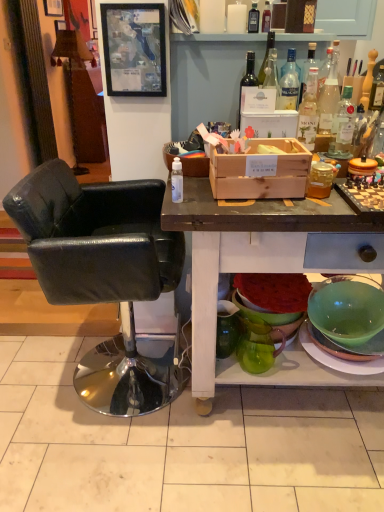
The image size is (384, 512). What do you see at coordinates (177, 181) in the screenshot? I see `transparent plastic spray bottle at center, positioned as the first bottle in front-to-back order` at bounding box center [177, 181].

Where is `matte black picture frame at upper center, the first picture frame positioned from the front`? Image resolution: width=384 pixels, height=512 pixels. matte black picture frame at upper center, the first picture frame positioned from the front is located at coordinates [x=134, y=49].

What do you see at coordinates (227, 328) in the screenshot?
I see `green glass pitcher at lower center, the second pitcher viewed from the right` at bounding box center [227, 328].

Describe the element at coordinates (265, 268) in the screenshot. I see `wooden crate at center` at that location.

What do you see at coordinates (344, 121) in the screenshot?
I see `clear glass bottle at upper right, acting as the seventh bottle starting from the back` at bounding box center [344, 121].

You are a GUI agent. You are given a task and a screenshot of the screen. Output one action in this format:
    pyautogui.click(x=<x>, y=<y>)
    Task: Click on the wooden knife block at upper right, which is counted as the 1th bottle, starting from the right
    This screenshot has height=512, width=384.
    Given the screenshot: What is the action you would take?
    pyautogui.click(x=368, y=79)

From a real-world perspective, which object rests below the other?

From a 3D spatial view, wooden crate at center is below.

Does wooden crate at center turn towards matte black picture frame at upper center, positioned as the 1th picture frame in right-to-left order?

No, wooden crate at center is not aimed at matte black picture frame at upper center, positioned as the 1th picture frame in right-to-left order.

Who is taller, wooden crate at center or matte black picture frame at upper center, positioned as the 1th picture frame in right-to-left order?

With more height is matte black picture frame at upper center, positioned as the 1th picture frame in right-to-left order.

From the picture: Between wooden crate at center and matte black picture frame at upper center, which appears as the 2th picture frame when viewed from the left, which one is positioned behind?

matte black picture frame at upper center, which appears as the 2th picture frame when viewed from the left, is further from the camera.

From a real-world perspective, which is physically below, wooden picture frame at upper left, the second picture frame from the front, or green glass pitcher at lower center, the first pitcher in the right-to-left sequence?

In real-world perspective, green glass pitcher at lower center, the first pitcher in the right-to-left sequence, is lower.

Which is behind, point (46, 1) or point (264, 353)?

The point (46, 1) is more distant.

From the image's perspective, which one is positioned lower, wooden picture frame at upper left, arranged as the 1th picture frame when viewed from the left, or green glass pitcher at lower center, the first pitcher in the right-to-left sequence?

green glass pitcher at lower center, the first pitcher in the right-to-left sequence, appears lower in the image.

Is the depth of wooden picture frame at upper left, arranged as the 1th picture frame when viewed from the left, less than that of green glass pitcher at lower center, the first pitcher in the right-to-left sequence?

No.

In the scene shown: Considering the positions of objects translucent glass bottle at upper center, arranged as the sixth bottle when viewed from the right, and matte glass wine bottle at upper center, positioned as the sixth bottle in back-to-front order, in the image provided, who is behind, translucent glass bottle at upper center, arranged as the sixth bottle when viewed from the right, or matte glass wine bottle at upper center, positioned as the sixth bottle in back-to-front order,?

translucent glass bottle at upper center, arranged as the sixth bottle when viewed from the right, is further from the camera.

Are translucent glass bottle at upper center, the 3th bottle positioned from the back, and matte glass wine bottle at upper center, which is counted as the fourth bottle, starting from the front, far apart?

translucent glass bottle at upper center, the 3th bottle positioned from the back, is near matte glass wine bottle at upper center, which is counted as the fourth bottle, starting from the front, not far away.

Considering the relative sizes of translucent glass bottle at upper center, arranged as the sixth bottle when viewed from the right, and matte glass wine bottle at upper center, the eighth bottle in the right-to-left sequence, in the image provided, is translucent glass bottle at upper center, arranged as the sixth bottle when viewed from the right, smaller than matte glass wine bottle at upper center, the eighth bottle in the right-to-left sequence,?

Yes, translucent glass bottle at upper center, arranged as the sixth bottle when viewed from the right, is smaller than matte glass wine bottle at upper center, the eighth bottle in the right-to-left sequence.

In the scene shown: From the image's perspective, is translucent glass bottle at upper center, which is the 7th bottle from front to back, located above or below matte glass wine bottle at upper center, which is counted as the 2th bottle, starting from the left?

Based on their image positions, translucent glass bottle at upper center, which is the 7th bottle from front to back, is located above matte glass wine bottle at upper center, which is counted as the 2th bottle, starting from the left.

From a real-world perspective, does translucent glass bottle at upper center, arranged as the sixth bottle when viewed from the right, sit lower than wooden picture frame at upper left, the first picture frame in the top-to-bottom sequence?

Yes.

Considering the sizes of translucent glass bottle at upper center, the 3th bottle positioned from the back, and wooden picture frame at upper left, which is the second picture frame in bottom-to-top order, in the image, is translucent glass bottle at upper center, the 3th bottle positioned from the back, taller or shorter than wooden picture frame at upper left, which is the second picture frame in bottom-to-top order,?

Considering their sizes, translucent glass bottle at upper center, the 3th bottle positioned from the back, has less height than wooden picture frame at upper left, which is the second picture frame in bottom-to-top order.

Based on the photo, is translucent glass bottle at upper center, which is the 7th bottle from front to back, not within wooden picture frame at upper left, arranged as the 1th picture frame when viewed from the left?

translucent glass bottle at upper center, which is the 7th bottle from front to back, lies outside wooden picture frame at upper left, arranged as the 1th picture frame when viewed from the left,'s area.

Is translucent glass bottle at upper center, the 3th bottle positioned from the back, to the left or to the right of wooden picture frame at upper left, the second picture frame from the front, in the image?

In the image, translucent glass bottle at upper center, the 3th bottle positioned from the back, appears on the right side of wooden picture frame at upper left, the second picture frame from the front.

Considering the relative sizes of green glass pitcher at lower center, the first pitcher in the right-to-left sequence, and translucent glass bottle at upper center, arranged as the sixth bottle when viewed from the right, in the image provided, is green glass pitcher at lower center, the first pitcher in the right-to-left sequence, bigger than translucent glass bottle at upper center, arranged as the sixth bottle when viewed from the right,?

Yes, green glass pitcher at lower center, the first pitcher in the right-to-left sequence, is bigger than translucent glass bottle at upper center, arranged as the sixth bottle when viewed from the right.

Can you tell me how much green glass pitcher at lower center, the 2th pitcher positioned from the left, and translucent glass bottle at upper center, which is the 7th bottle from front to back, differ in facing direction?

85 degrees separate the facing orientations of green glass pitcher at lower center, the 2th pitcher positioned from the left, and translucent glass bottle at upper center, which is the 7th bottle from front to back.

From their relative heights in the image, would you say green glass pitcher at lower center, the first pitcher in the right-to-left sequence, is taller or shorter than translucent glass bottle at upper center, which ranks as the 4th bottle in left-to-right order?

Clearly, green glass pitcher at lower center, the first pitcher in the right-to-left sequence, is taller compared to translucent glass bottle at upper center, which ranks as the 4th bottle in left-to-right order.

Is green glass pitcher at lower center, the first pitcher in the right-to-left sequence, inside or outside of translucent glass bottle at upper center, the 3th bottle positioned from the back?

green glass pitcher at lower center, the first pitcher in the right-to-left sequence, is not inside translucent glass bottle at upper center, the 3th bottle positioned from the back, it's outside.

Are matte glass wine bottle at upper center, positioned as the sixth bottle in back-to-front order, and wooden crate at center far apart?

No, there isn't a large distance between matte glass wine bottle at upper center, positioned as the sixth bottle in back-to-front order, and wooden crate at center.

Which point is more forward, (249, 78) or (295, 173)?

The point (295, 173) is more forward.

Is matte glass wine bottle at upper center, the eighth bottle in the right-to-left sequence, positioned with its back to wooden crate at center?

No.

You are a GUI agent. You are given a task and a screenshot of the screen. Output one action in this format:
    pyautogui.click(x=<x>, y=<y>)
    Task: Click on the lamp beneath the black glass bottle at upper center, arranged as the 7th bottle when viewed from the right (from a real-world perspective)
    The height and width of the screenshot is (512, 384).
    Given the screenshot: What is the action you would take?
    [x=72, y=76]

Is wooden textured lamp at upper left at the right side of black glass bottle at upper center, arranged as the 7th bottle when viewed from the right?

Incorrect, wooden textured lamp at upper left is not on the right side of black glass bottle at upper center, arranged as the 7th bottle when viewed from the right.

From the image's perspective, which is above, wooden textured lamp at upper left or black glass bottle at upper center, which is the 3th bottle in left-to-right order?

wooden textured lamp at upper left.

Where is `box in front of the matte black picture frame at upper center, the second picture frame positioned from the top`? The width and height of the screenshot is (384, 512). box in front of the matte black picture frame at upper center, the second picture frame positioned from the top is located at coordinates (261, 170).

Where is `picture frame behind the green glass pitcher at lower center, the first pitcher in the right-to-left sequence`? Image resolution: width=384 pixels, height=512 pixels. picture frame behind the green glass pitcher at lower center, the first pitcher in the right-to-left sequence is located at coordinates (53, 8).

Estimate the real-world distances between objects in this image. Which object is further from matte black picture frame at upper center, marked as the second picture frame in a back-to-front arrangement, clear glass bottle at upper right, the 7th bottle when ordered from left to right, or clear glass bottle at upper right, the second bottle in the right-to-left sequence?

clear glass bottle at upper right, the second bottle in the right-to-left sequence, is positioned further to the anchor matte black picture frame at upper center, marked as the second picture frame in a back-to-front arrangement.

From the image, which object appears to be nearer to transparent plastic spray bottle at center, which is the 9th bottle from back to front, clear glass bottle at upper right, the 7th bottle when ordered from left to right, or clear glass bottle at upper right, the fifth bottle positioned from the right?

clear glass bottle at upper right, the fifth bottle positioned from the right, is closer to transparent plastic spray bottle at center, which is the 9th bottle from back to front.

Looking at the image, which one is located further to transparent plastic spray bottle at center, which is the 9th bottle from back to front, green glass pitcher at lower center, the first pitcher in the right-to-left sequence, or clear glass bottle at upper right, acting as the fifth bottle starting from the back?

green glass pitcher at lower center, the first pitcher in the right-to-left sequence.

From the image, which object appears to be farther from wooden picture frame at upper left, the first picture frame in the top-to-bottom sequence, clear glass bottle at upper right, which ranks as the fourth bottle in back-to-front order, or green glass pitcher at lower center, the second pitcher viewed from the right?

green glass pitcher at lower center, the second pitcher viewed from the right.

When comparing their distances from clear glass bottle at upper right, the fifth bottle positioned from the right, does green glass pitcher at lower center, the 2th pitcher positioned from the left, or wooden picture frame at upper left, the second picture frame positioned from the right, seem further?

The object further to clear glass bottle at upper right, the fifth bottle positioned from the right, is wooden picture frame at upper left, the second picture frame positioned from the right.

When comparing their distances from wooden crate at center, does wooden crate at center or wooden textured lamp at upper left seem closer?

wooden crate at center is positioned closer to the anchor wooden crate at center.

Looking at this image, when comparing their distances from clear glass bottle at upper right, which is the 3th bottle from front to back, does clear glass bottle at upper right, acting as the 6th bottle starting from the front, or black glass bottle at upper center, arranged as the 7th bottle when viewed from the right, seem further?

The object further to clear glass bottle at upper right, which is the 3th bottle from front to back, is black glass bottle at upper center, arranged as the 7th bottle when viewed from the right.

Considering their positions, is wooden crate at center positioned further to translucent glass bottle at upper center, which ranks as the 4th bottle in left-to-right order, than green glass pitcher at lower center, the first pitcher when ordered from left to right?

green glass pitcher at lower center, the first pitcher when ordered from left to right, lies further to translucent glass bottle at upper center, which ranks as the 4th bottle in left-to-right order, than the other object.

This screenshot has height=512, width=384. Find the location of `chair between matte glass wine bottle at upper center, which is counted as the 2th bottle, starting from the left, and green glass pitcher at lower center, the second pitcher viewed from the right, vertically`. chair between matte glass wine bottle at upper center, which is counted as the 2th bottle, starting from the left, and green glass pitcher at lower center, the second pitcher viewed from the right, vertically is located at coordinates (104, 274).

The width and height of the screenshot is (384, 512). Find the location of `picture frame between translucent glass bottle at upper center, arranged as the sixth bottle when viewed from the right, and wooden crate at center vertically`. picture frame between translucent glass bottle at upper center, arranged as the sixth bottle when viewed from the right, and wooden crate at center vertically is located at coordinates (134, 49).

You are a GUI agent. You are given a task and a screenshot of the screen. Output one action in this format:
    pyautogui.click(x=<x>, y=<y>)
    Task: Click on the box between matte black picture frame at upper center, marked as the second picture frame in a back-to-front arrangement, and green glass pitcher at lower center, the first pitcher when ordered from left to right, in the up-down direction
    This screenshot has height=512, width=384.
    Given the screenshot: What is the action you would take?
    pyautogui.click(x=261, y=170)

Where is `box between matte glass wine bottle at upper center, positioned as the sixth bottle in back-to-front order, and green glass pitcher at lower center, the 2th pitcher positioned from the left, vertically`? box between matte glass wine bottle at upper center, positioned as the sixth bottle in back-to-front order, and green glass pitcher at lower center, the 2th pitcher positioned from the left, vertically is located at coordinates (261, 170).